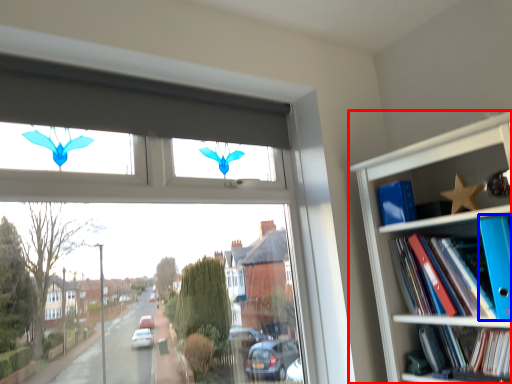
Question: Which object is closer to the camera taking this photo, bookcase (highlighted by a red box) or paperback book (highlighted by a blue box)?

Choices:
 (A) bookcase
 (B) paperback book

Answer: (A)